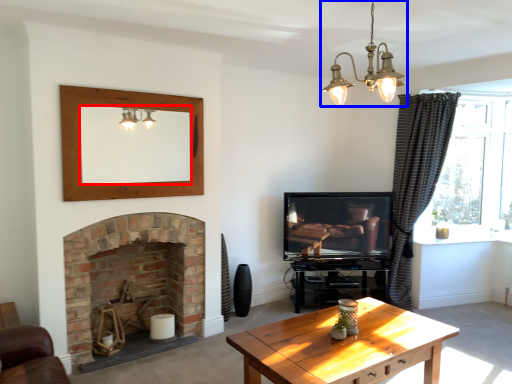
Question: Which point is closer to the camera, mirror (highlighted by a red box) or light fixture (highlighted by a blue box)?

Choices:
 (A) mirror
 (B) light fixture

Answer: (B)